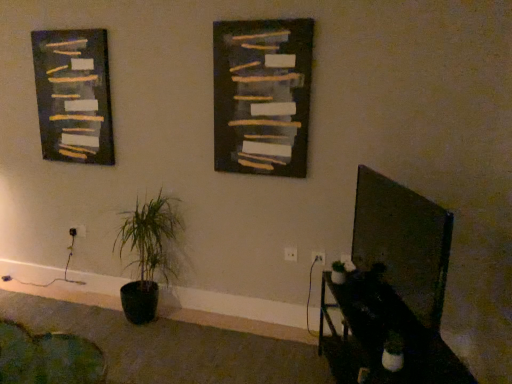
Question: Can you confirm if green matte plant at lower left is wider than dark gray textured painting at left?

Choices:
 (A) yes
 (B) no

Answer: (A)

Question: Considering the relative sizes of green matte plant at lower left and dark gray textured painting at left in the image provided, is green matte plant at lower left thinner than dark gray textured painting at left?

Choices:
 (A) no
 (B) yes

Answer: (A)

Question: Does green matte plant at lower left have a larger size compared to dark gray textured painting at left?

Choices:
 (A) no
 (B) yes

Answer: (B)

Question: Is there a large distance between green matte plant at lower left and dark gray textured painting at left?

Choices:
 (A) no
 (B) yes

Answer: (A)

Question: Can you confirm if green matte plant at lower left is smaller than dark gray textured painting at left?

Choices:
 (A) no
 (B) yes

Answer: (A)

Question: From a real-world perspective, is dark gray textured painting at left above or below black glossy table at lower right?

Choices:
 (A) above
 (B) below

Answer: (A)

Question: Relative to black glossy table at lower right, is dark gray textured painting at left in front or behind?

Choices:
 (A) front
 (B) behind

Answer: (B)

Question: Considering the relative positions of dark gray textured painting at left and black glossy table at lower right in the image provided, is dark gray textured painting at left to the left or to the right of black glossy table at lower right?

Choices:
 (A) left
 (B) right

Answer: (A)

Question: Looking at the image, does dark gray textured painting at left seem bigger or smaller compared to black glossy table at lower right?

Choices:
 (A) big
 (B) small

Answer: (B)

Question: Do you think dark matte board at center is within green fabric swivel chair at lower left, or outside of it?

Choices:
 (A) inside
 (B) outside

Answer: (B)

Question: From the image's perspective, relative to green fabric swivel chair at lower left, is dark matte board at center above or below?

Choices:
 (A) below
 (B) above

Answer: (B)

Question: From their relative heights in the image, would you say dark matte board at center is taller or shorter than green fabric swivel chair at lower left?

Choices:
 (A) tall
 (B) short

Answer: (A)

Question: Looking at the image, does dark matte board at center seem bigger or smaller compared to green fabric swivel chair at lower left?

Choices:
 (A) big
 (B) small

Answer: (B)

Question: Is white plastic electric outlet at lower left, the first electric outlet viewed from the left, spatially inside green fabric swivel chair at lower left, or outside of it?

Choices:
 (A) outside
 (B) inside

Answer: (A)

Question: From their relative heights in the image, would you say white plastic electric outlet at lower left, the 3th electric outlet viewed from the front, is taller or shorter than green fabric swivel chair at lower left?

Choices:
 (A) short
 (B) tall

Answer: (A)